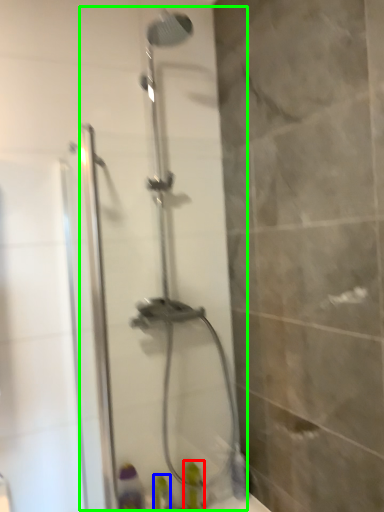
Question: Which is farther away from toiletry (highlighted by a red box)? toiletry (highlighted by a blue box) or shower door (highlighted by a green box)?

Choices:
 (A) toiletry
 (B) shower door

Answer: (B)